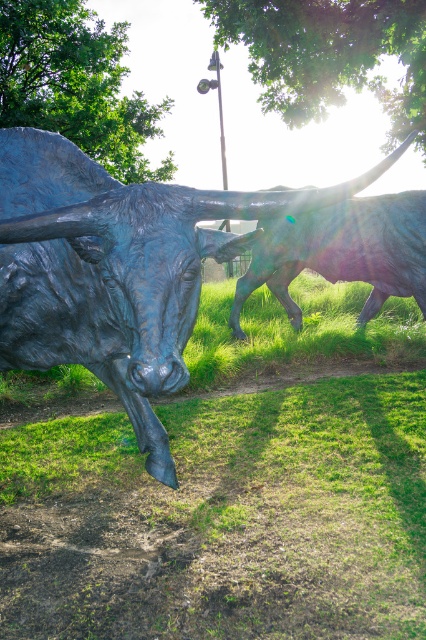
You are standing in the park and see the bronze textured bull at left. If you want to take a photo of it from the front, where should you position yourself relative to the bull?

To take a photo of the bronze textured bull at left from the front, you should position yourself directly in front of it, facing its head, as that is the standard front view for such sculptures.

You are standing at the point marked by the coordinates point (230, 490) in the image. What is the immediate surface you are standing on?

The point (230, 490) corresponds to green grass at center, so you are standing on green grass at center.

Based on the photo, you are a photographer trying to capture a photo of the shiny bronze bull at center. You notice the green grass at center in the background. Which object is located to the left of the other?

The green grass at center is positioned on the left side of shiny bronze bull at center.